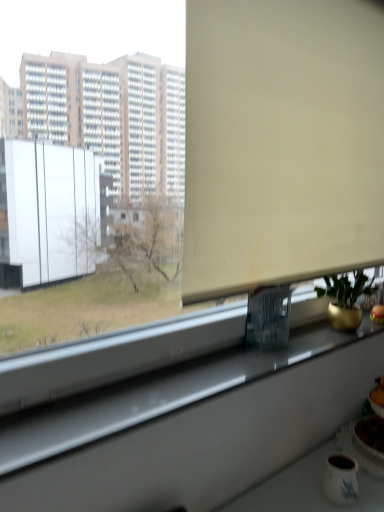
I want to click on white glossy window sill at lower center, so click(x=158, y=396).

Describe the element at coordinates (282, 142) in the screenshot. This screenshot has height=512, width=384. I see `beige matte window screen at upper center` at that location.

The image size is (384, 512). I want to click on matte white mug at lower right, so click(340, 479).

The image size is (384, 512). Describe the element at coordinates (345, 298) in the screenshot. I see `gold metallic pot at right` at that location.

You are a GUI agent. You are given a task and a screenshot of the screen. Output one action in this format:
    pyautogui.click(x=<x>, y=<y>)
    Task: Click on the white glossy window sill at lower center
    
    Given the screenshot: What is the action you would take?
    pyautogui.click(x=158, y=396)

How many degrees apart are the facing directions of white glossy window sill at lower center and gold metallic pot at right?

2.5 degrees separate the facing orientations of white glossy window sill at lower center and gold metallic pot at right.

Between white glossy window sill at lower center and gold metallic pot at right, which one has smaller width?

Thinner between the two is gold metallic pot at right.

From the picture: Could you tell me if white glossy window sill at lower center is turned towards gold metallic pot at right?

No, white glossy window sill at lower center is not oriented towards gold metallic pot at right.

Considering the positions of point (217, 355) and point (347, 296), is point (217, 355) closer or farther from the camera than point (347, 296)?

Point (217, 355) is positioned closer to the camera compared to point (347, 296).

Consider the image. Does gold metallic pot at right appear on the right side of matte white mug at lower right?

Yes.

Is matte white mug at lower right at the back of gold metallic pot at right?

No.

Is gold metallic pot at right far from matte white mug at lower right?

That's not correct — gold metallic pot at right is a little close to matte white mug at lower right.

Looking at this image, is matte white mug at lower right inside gold metallic pot at right?

No, matte white mug at lower right is not inside gold metallic pot at right.

Does matte white mug at lower right turn towards white glossy window sill at lower center?

No, matte white mug at lower right does not turn towards white glossy window sill at lower center.

Consider the image. Does matte white mug at lower right have a lesser width compared to white glossy window sill at lower center?

Indeed, matte white mug at lower right has a lesser width compared to white glossy window sill at lower center.

Is matte white mug at lower right inside the boundaries of white glossy window sill at lower center, or outside?

matte white mug at lower right is outside white glossy window sill at lower center.

From the image's perspective, which object appears higher, matte white mug at lower right or white glossy window sill at lower center?

From the image's view, white glossy window sill at lower center is above.

What's the angular difference between matte white mug at lower right and gold metallic pot at right's facing directions?

matte white mug at lower right and gold metallic pot at right are facing 3.47 degrees away from each other.

This screenshot has height=512, width=384. I want to click on houseplant above the matte white mug at lower right (from the image's perspective), so click(345, 298).

Is gold metallic pot at right at the back of matte white mug at lower right?

No, matte white mug at lower right's orientation is not away from gold metallic pot at right.

Does matte white mug at lower right have a smaller size compared to gold metallic pot at right?

Yes, matte white mug at lower right is smaller than gold metallic pot at right.

From a real-world perspective, who is located lower, beige matte window screen at upper center or white glossy window sill at lower center?

In real-world perspective, white glossy window sill at lower center is lower.

Could you tell me if beige matte window screen at upper center is facing white glossy window sill at lower center?

No, beige matte window screen at upper center does not turn towards white glossy window sill at lower center.

Considering the sizes of beige matte window screen at upper center and white glossy window sill at lower center in the image, is beige matte window screen at upper center taller or shorter than white glossy window sill at lower center?

Considering their sizes, beige matte window screen at upper center has more height than white glossy window sill at lower center.

Considering the positions of objects beige matte window screen at upper center and white glossy window sill at lower center in the image provided, who is in front, beige matte window screen at upper center or white glossy window sill at lower center?

white glossy window sill at lower center is closer to the camera.

Measure the distance from beige matte window screen at upper center to gold metallic pot at right.

beige matte window screen at upper center and gold metallic pot at right are 19.12 inches apart from each other.

How many degrees apart are the facing directions of beige matte window screen at upper center and gold metallic pot at right?

The facing directions of beige matte window screen at upper center and gold metallic pot at right are 3.22 degrees apart.

Considering the points (207, 33) and (359, 310), which point is behind, point (207, 33) or point (359, 310)?

Point (359, 310)

Is beige matte window screen at upper center positioned beyond the bounds of gold metallic pot at right?

Absolutely, beige matte window screen at upper center is external to gold metallic pot at right.

From the image's perspective, relative to beige matte window screen at upper center, is white glossy window sill at lower center above or below?

Clearly, from the image's perspective, white glossy window sill at lower center is below beige matte window screen at upper center.

Does white glossy window sill at lower center lie in front of beige matte window screen at upper center?

Yes.

Which object is wider, white glossy window sill at lower center or beige matte window screen at upper center?

white glossy window sill at lower center is wider.

Identify the location of houseplant on the right of white glossy window sill at lower center. (345, 298).

The image size is (384, 512). I want to click on houseplant above the matte white mug at lower right (from the image's perspective), so click(x=345, y=298).

When comparing their distances from gold metallic pot at right, does matte white mug at lower right or white glossy window sill at lower center seem closer?

white glossy window sill at lower center lies closer to gold metallic pot at right than the other object.

When comparing their distances from matte white mug at lower right, does gold metallic pot at right or white glossy window sill at lower center seem closer?

white glossy window sill at lower center is positioned closer to the anchor matte white mug at lower right.

Looking at the image, which one is located closer to matte white mug at lower right, beige matte window screen at upper center or gold metallic pot at right?

Among the two, gold metallic pot at right is located nearer to matte white mug at lower right.

When comparing their distances from matte white mug at lower right, does beige matte window screen at upper center or white glossy window sill at lower center seem further?

beige matte window screen at upper center lies further to matte white mug at lower right than the other object.

Consider the image. Looking at the image, which one is located further to matte white mug at lower right, white glossy window sill at lower center or beige matte window screen at upper center?

Based on the image, beige matte window screen at upper center appears to be further to matte white mug at lower right.

Considering their positions, is gold metallic pot at right positioned closer to beige matte window screen at upper center than white glossy window sill at lower center?

gold metallic pot at right lies closer to beige matte window screen at upper center than the other object.

Looking at the image, which one is located further to white glossy window sill at lower center, gold metallic pot at right or matte white mug at lower right?

matte white mug at lower right lies further to white glossy window sill at lower center than the other object.

Considering their positions, is beige matte window screen at upper center positioned closer to gold metallic pot at right than white glossy window sill at lower center?

Among the two, white glossy window sill at lower center is located nearer to gold metallic pot at right.

At what (x,y) coordinates should I click in order to perform the action: click on mug positioned between white glossy window sill at lower center and gold metallic pot at right from near to far. Please return your answer as a coordinate pair (x, y). Looking at the image, I should click on (340, 479).

Locate an element on the screen. This screenshot has width=384, height=512. houseplant between beige matte window screen at upper center and white glossy window sill at lower center vertically is located at coordinates (345, 298).

This screenshot has height=512, width=384. In order to click on window sill between beige matte window screen at upper center and matte white mug at lower right in the up-down direction in this screenshot , I will do `click(158, 396)`.

Identify the location of houseplant between beige matte window screen at upper center and matte white mug at lower right in the up-down direction. The width and height of the screenshot is (384, 512). (345, 298).